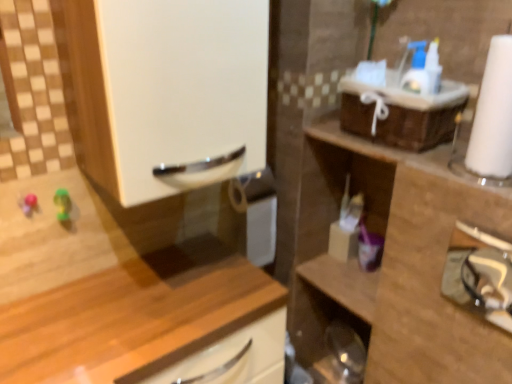
Question: Which is correct: metallic silver hairdryer at right is inside translucent plastic container at center-right, which is counted as the second toiletry, starting from the right, or outside of it?

Choices:
 (A) outside
 (B) inside

Answer: (A)

Question: In the image, is metallic silver hairdryer at right on the left side or the right side of translucent plastic container at center-right, which appears as the first toiletry when viewed from the left?

Choices:
 (A) right
 (B) left

Answer: (A)

Question: Considering the real-world distances, which object is closest to the translucent plastic container at center-right, which is counted as the second toiletry, starting from the right?

Choices:
 (A) metallic silver hairdryer at right
 (B) wooden cabinet at lower left, marked as the first cabinetry in a left-to-right arrangement
 (C) white glossy cabinet handle at upper left
 (D) wooden cabinet at right, acting as the second cabinetry starting from the left
 (E) purple plastic toothbrush at center-right, which is counted as the second toiletry, starting from the left

Answer: (E)

Question: Estimate the real-world distances between objects in this image. Which object is closer to the white glossy cabinet handle at upper left?

Choices:
 (A) metallic silver hairdryer at right
 (B) wooden cabinet at lower left, the second cabinetry in the right-to-left sequence
 (C) translucent plastic container at center-right, which is counted as the second toiletry, starting from the right
 (D) wooden cabinet at right, acting as the second cabinetry starting from the left
 (E) purple plastic toothbrush at center-right, which is counted as the second toiletry, starting from the left

Answer: (B)